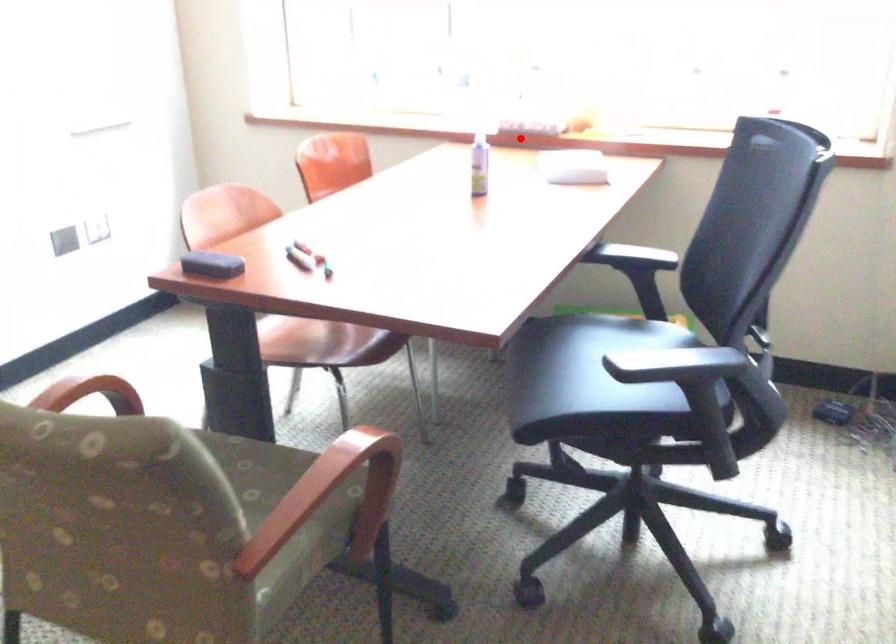
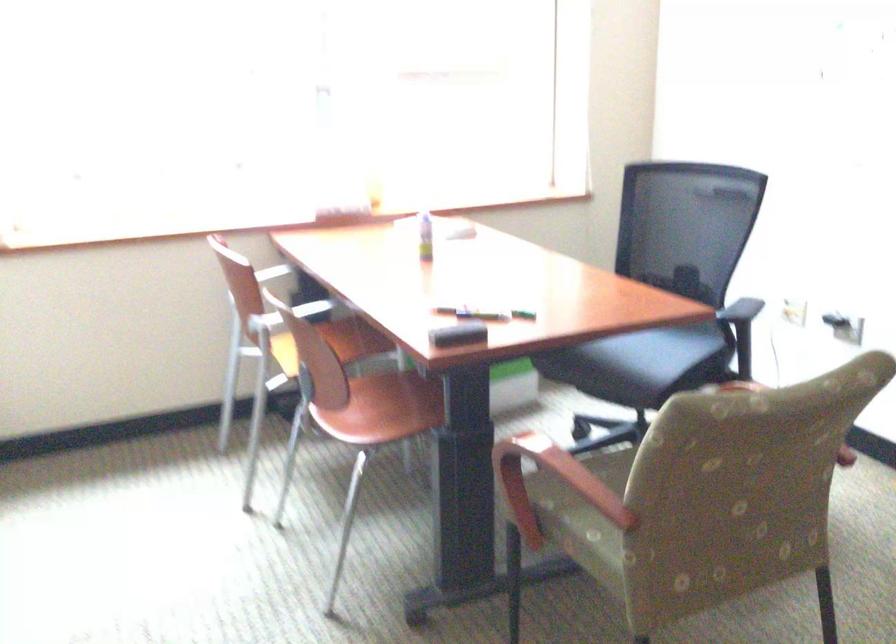
Find the pixel in the second image that matches the highlighted location in the first image.

(346, 214)